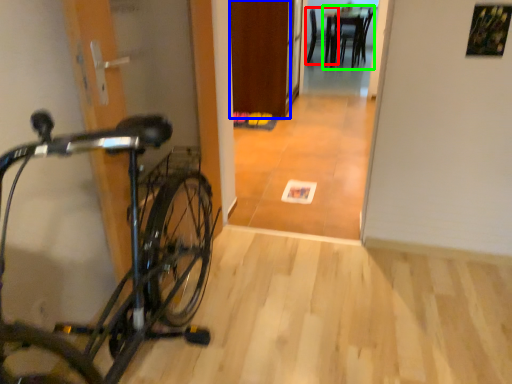
Question: Which object is the closest to the chair (highlighted by a red box)? Choose among these: door (highlighted by a blue box) or table (highlighted by a green box).

Choices:
 (A) door
 (B) table

Answer: (B)